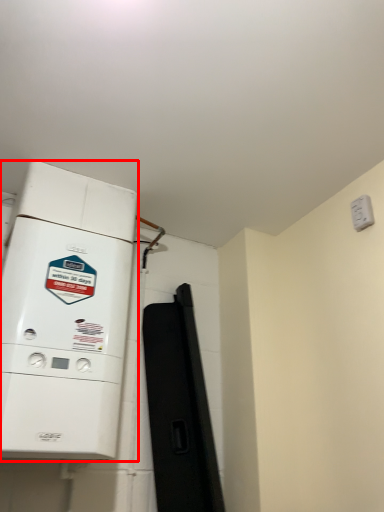
Question: From the image, what is the correct spatial relationship of home appliance (annotated by the red box) in relation to electric outlet?

Choices:
 (A) right
 (B) left

Answer: (B)